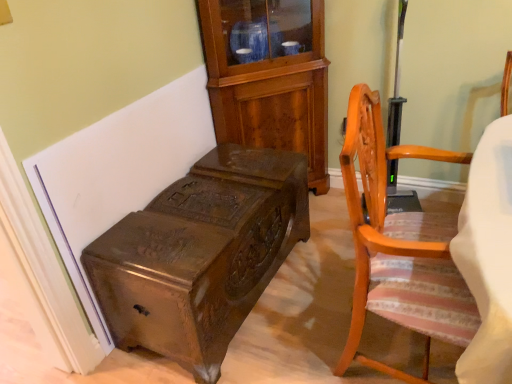
Question: Is mahogany cabinet at upper center to the left or to the right of polished dark wood trunk at lower left in the image?

Choices:
 (A) right
 (B) left

Answer: (A)

Question: Which is correct: mahogany cabinet at upper center is inside polished dark wood trunk at lower left, or outside of it?

Choices:
 (A) outside
 (B) inside

Answer: (A)

Question: Considering the real-world distances, which object is farthest from the polished dark wood trunk at lower left?

Choices:
 (A) light brown wood chair at right
 (B) mahogany cabinet at upper center

Answer: (B)

Question: Estimate the real-world distances between objects in this image. Which object is farther from the polished dark wood trunk at lower left?

Choices:
 (A) light brown wood chair at right
 (B) mahogany cabinet at upper center

Answer: (B)